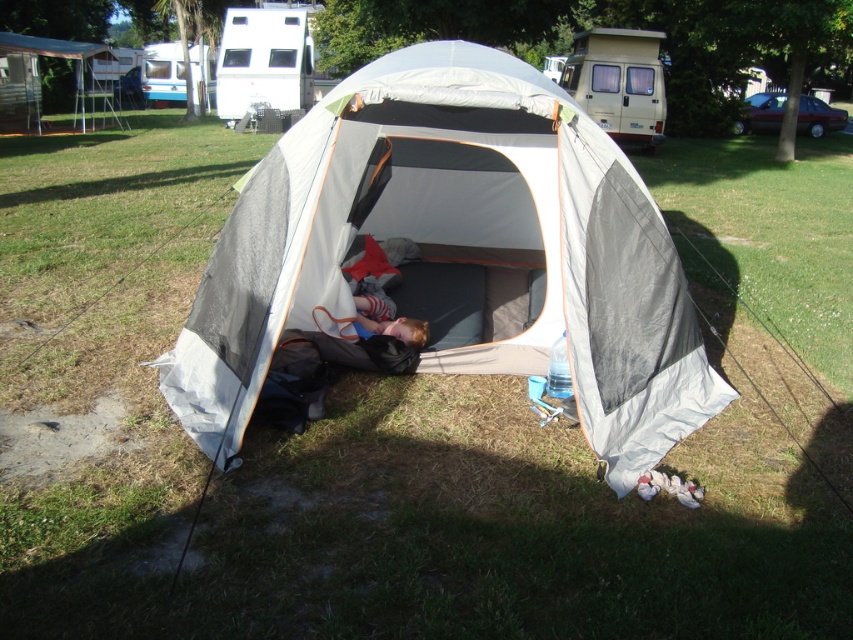
You are setting up a campsite and need to decide where to place your gear. You have a white plastic camper at upper left and a white fabric canopy at upper left. Which of these items is smaller in size?

The white plastic camper at upper left is smaller in size compared to the white fabric canopy at upper left according to the description.

You are a hiker who just arrived at the campsite. You see the matte blue shirt at lower center and the beige plastic recreational vehicle at upper center. Which object is closer to the left side of the image?

The matte blue shirt at lower center is closer to the left side of the image because it is positioned to the left of the beige plastic recreational vehicle at upper center.

You are planning to set up a tent in your backyard and want to compare sizes. Based on the camping scene, which object is wider, the white fabric tent at center or the blue metallic trailer at upper left?

The white fabric tent at center is wider than the blue metallic trailer at upper left according to the description.